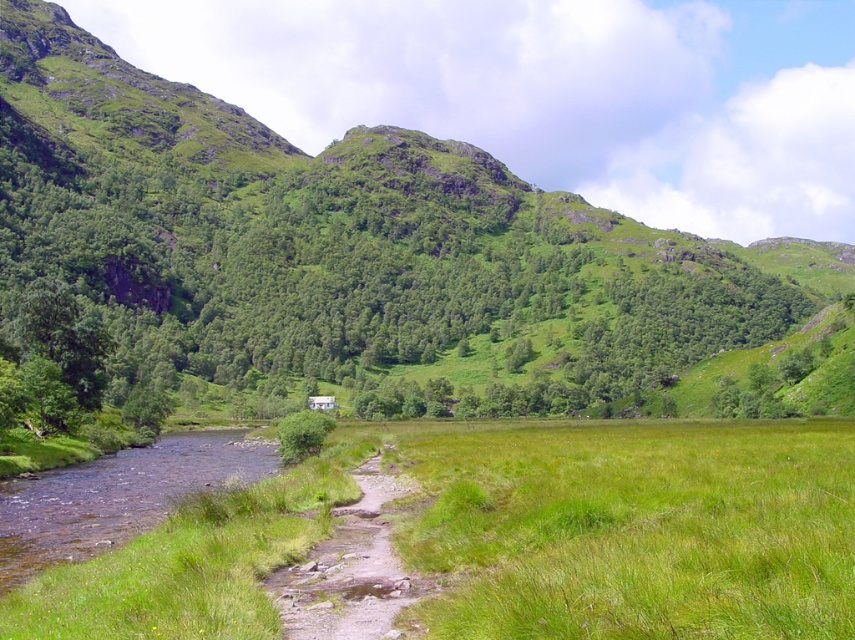
Question: Which point appears closest to the camera in this image?

Choices:
 (A) (712, 252)
 (B) (351, 474)
 (C) (205, 460)

Answer: (B)

Question: Which of the following is the farthest from the observer?

Choices:
 (A) clear water at bottom left
 (B) green grassy hillside at center
 (C) dirt path at lower center

Answer: (B)

Question: Which point appears farthest from the camera in this image?

Choices:
 (A) (222, 477)
 (B) (541, 358)

Answer: (B)

Question: Is green grassy hillside at center closer to camera compared to dirt path at lower center?

Choices:
 (A) yes
 (B) no

Answer: (B)

Question: Is green grassy hillside at center thinner than clear water at bottom left?

Choices:
 (A) yes
 (B) no

Answer: (B)

Question: Does green grassy hillside at center have a larger size compared to dirt path at lower center?

Choices:
 (A) yes
 (B) no

Answer: (A)